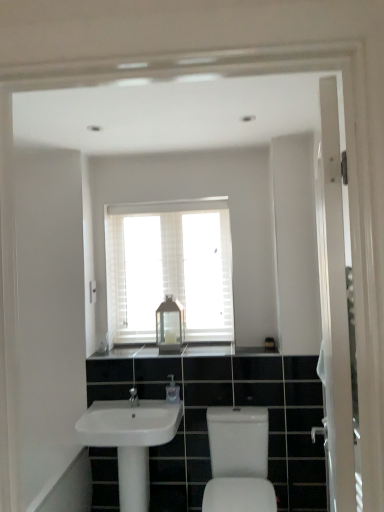
Find the location of a particular element. free space to the right of matte silver tap at center is located at coordinates [153, 403].